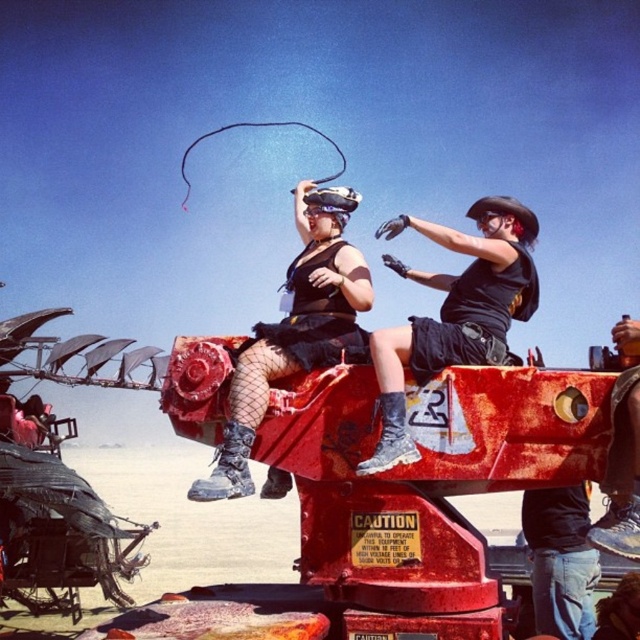
Question: Does black matte helmet at upper right lie in front of jeans at lower right?

Choices:
 (A) yes
 (B) no

Answer: (A)

Question: Among these points, which one is farthest from the camera?

Choices:
 (A) click(556, 492)
 (B) click(339, 358)
 (C) click(426, 368)

Answer: (A)

Question: Among these objects, which one is nearest to the camera?

Choices:
 (A) matte black helmet at center
 (B) black matte helmet at upper right

Answer: (B)

Question: Does black matte helmet at upper right lie in front of matte black helmet at center?

Choices:
 (A) no
 (B) yes

Answer: (B)

Question: Is black matte helmet at upper right further to camera compared to matte black helmet at center?

Choices:
 (A) yes
 (B) no

Answer: (B)

Question: Which of the following is the farthest from the observer?

Choices:
 (A) matte black helmet at center
 (B) jeans at lower right

Answer: (B)